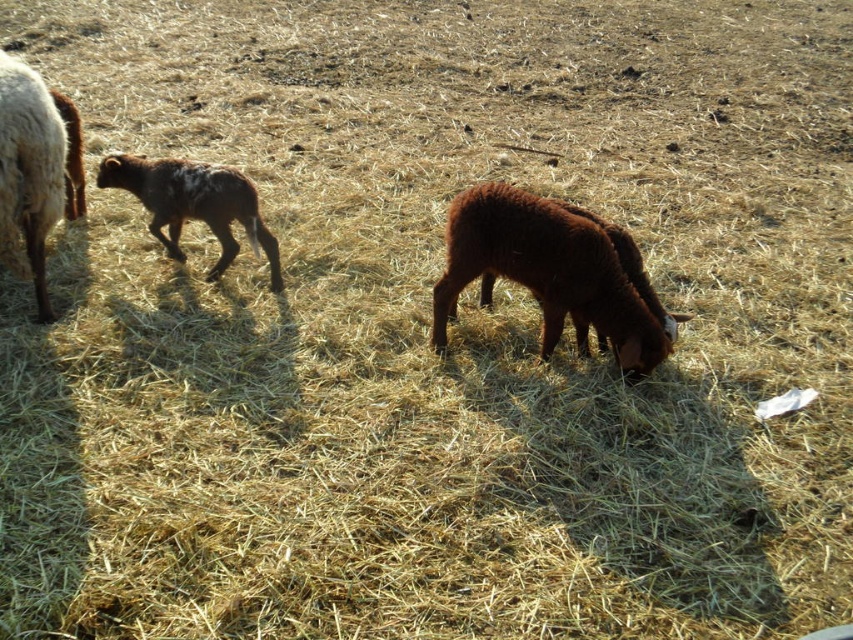
You are a farmer checking on your livestock in the field. You notice the brown woolen lamb at center and the white woolen sheep at left. Which animal is positioned lower in the image?

The brown woolen lamb at center is positioned lower in the image than the white woolen sheep at left.

You are a farmer checking the health of your lambs. You notice the brown woolen lamb at center and the speckled brown lamb at left. Which lamb is taller?

The brown woolen lamb at center is taller than the speckled brown lamb at left.